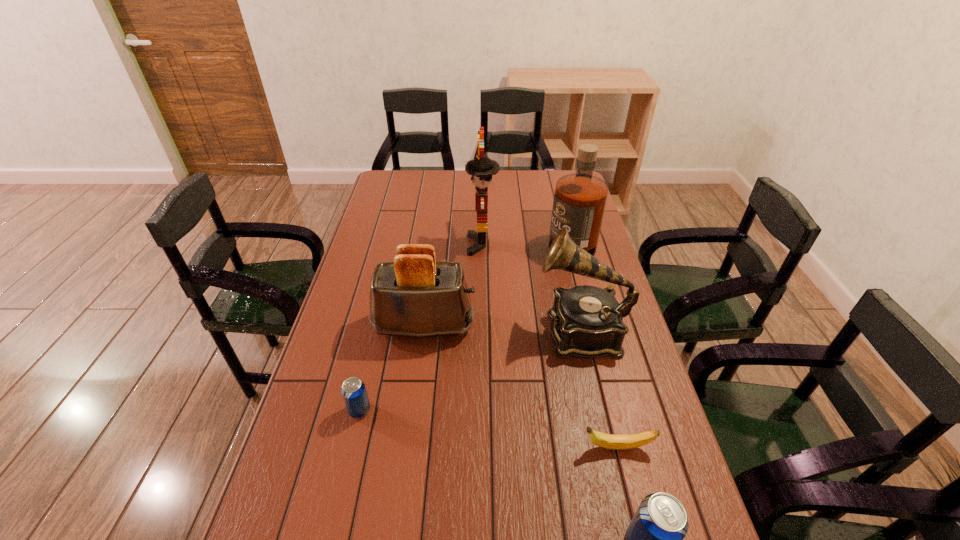
Where is `free region at the near left corner of the desktop`? This screenshot has height=540, width=960. free region at the near left corner of the desktop is located at coordinates (323, 509).

In order to click on free space at the near right corner of the desktop in this screenshot , I will do `click(692, 516)`.

Identify the location of free space between the liquor and the fourth tallest object. The height and width of the screenshot is (540, 960). (496, 281).

The image size is (960, 540). In order to click on free spot between the phonograph record and the farther beer can in this screenshot , I will do `click(470, 370)`.

At what (x,y) coordinates should I click in order to perform the action: click on free space between the farther beer can and the shortest object. Please return your answer as a coordinate pair (x, y). The width and height of the screenshot is (960, 540). Looking at the image, I should click on (489, 429).

I want to click on free space between the liquor and the fourth tallest object, so click(496, 281).

Where is `free area in between the fourth shortest object and the shorter beer can`? Image resolution: width=960 pixels, height=540 pixels. free area in between the fourth shortest object and the shorter beer can is located at coordinates (392, 368).

Where is `object that is the fourth closest to the liquor`? This screenshot has width=960, height=540. object that is the fourth closest to the liquor is located at coordinates (628, 441).

Identify which object is the fourth nearest to the shortest object. Please provide its 2D coordinates. Your answer should be formatted as a tuple, i.e. [(x, y)], where the tuple contains the x and y coordinates of a point satisfying the conditions above.

[(353, 390)]